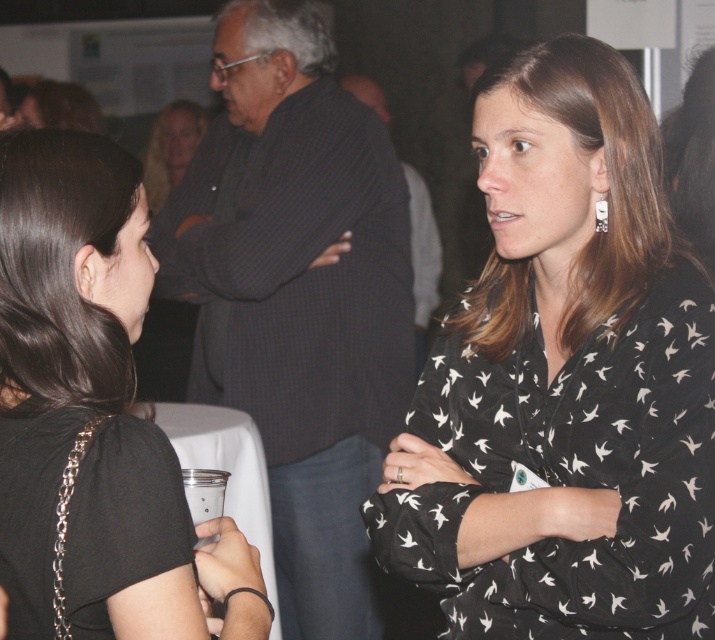
You are at a party and want to know which person is closer to you between the black matte shirt at left and the matte black shirt at upper center. Based on their positions, which one is nearer?

The black matte shirt at left is positioned under the matte black shirt at upper center, meaning it is closer to you.

You are a photographer at the event and want to capture both the dark gray checkered shirt at center and the black matte shirt at left in a single portrait. Given their height difference, which shirt should you position closer to the camera to ensure both are fully visible in the frame?

The dark gray checkered shirt at center is taller than the black matte shirt at left, so you should position the black matte shirt at left closer to the camera to balance their visibility in the portrait.